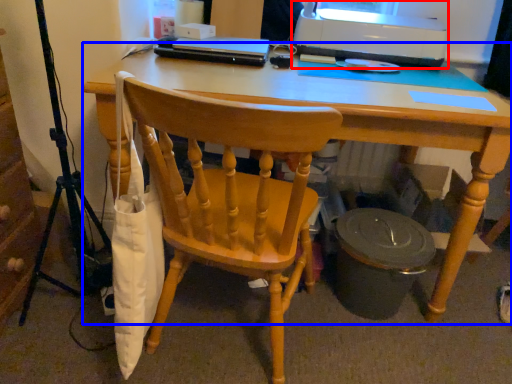
Question: Which point is further to the camera, printer (highlighted by a red box) or desk (highlighted by a blue box)?

Choices:
 (A) printer
 (B) desk

Answer: (A)